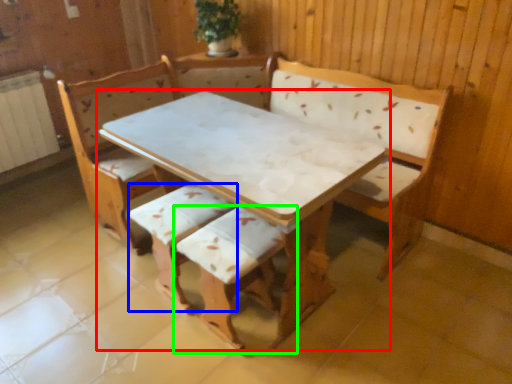
Question: Considering the real-world distances, which object is closest to table (highlighted by a red box)? armchair (highlighted by a blue box) or armchair (highlighted by a green box).

Choices:
 (A) armchair
 (B) armchair

Answer: (B)